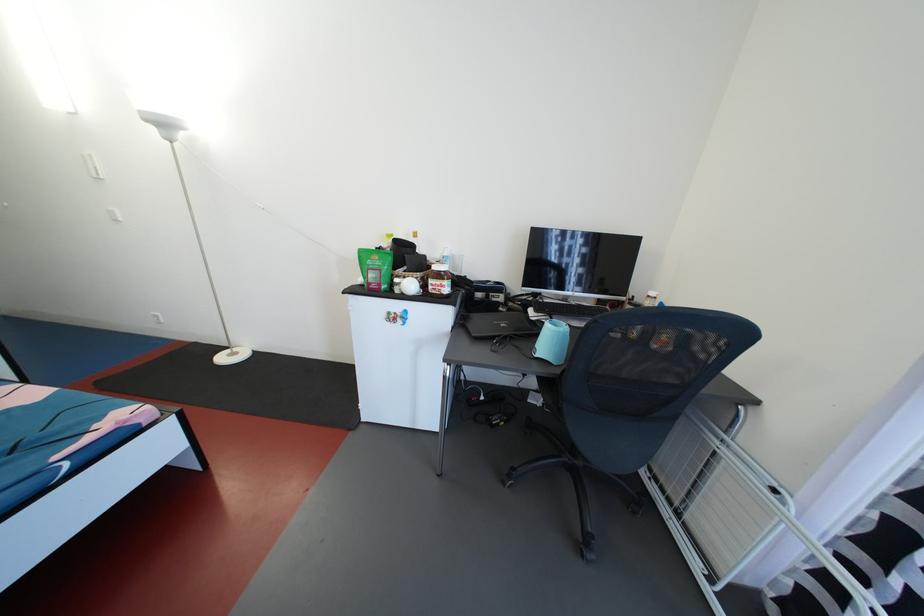
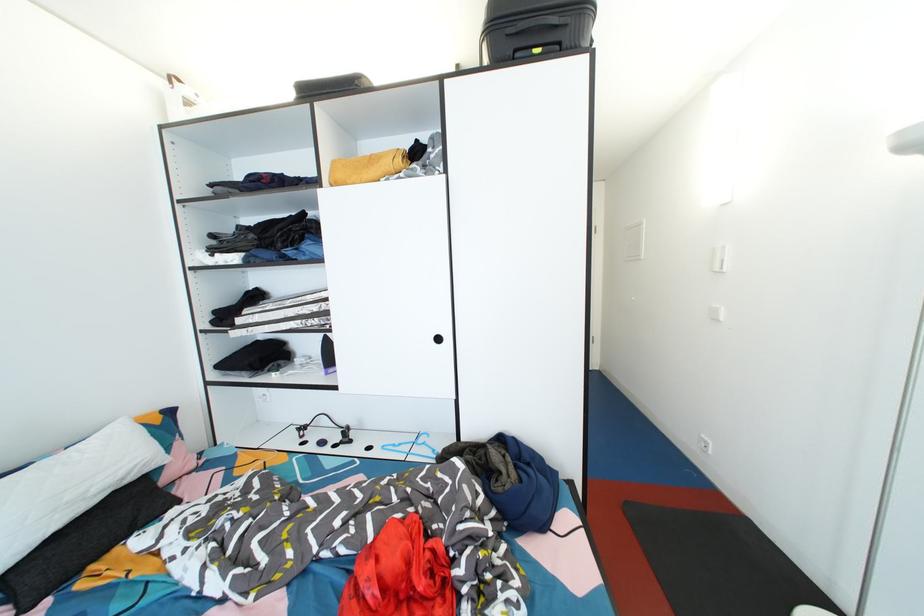
In the second image, find the point that corresponds to (152,126) in the first image.

(913, 152)